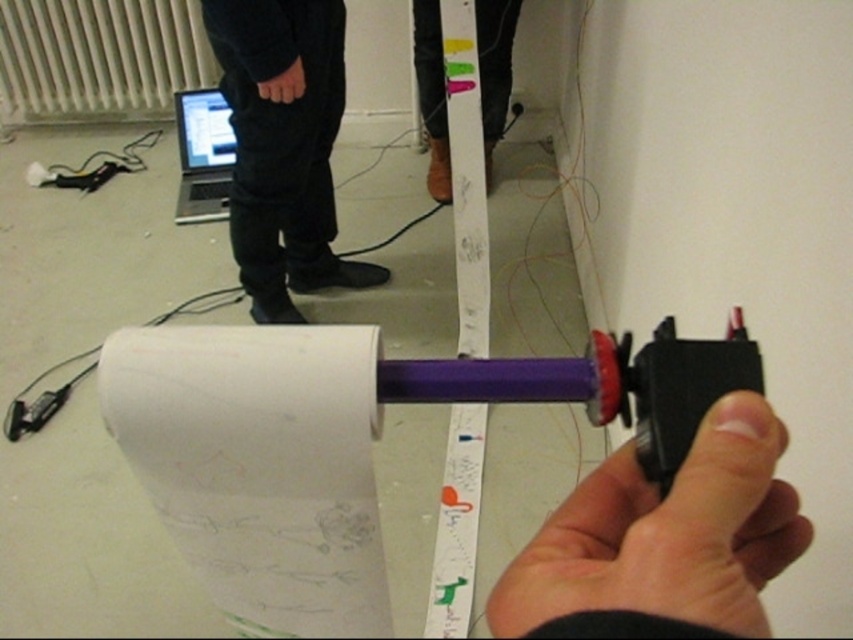
Question: Which point is farther from the camera taking this photo?

Choices:
 (A) (231, 154)
 (B) (743, 400)

Answer: (A)

Question: Does brown leather shoes at lower center have a larger size compared to silver metallic laptop at upper left?

Choices:
 (A) no
 (B) yes

Answer: (B)

Question: Is black matte hand at center above silver metallic laptop at upper left?

Choices:
 (A) no
 (B) yes

Answer: (A)

Question: Which point is farther to the camera?

Choices:
 (A) white textured radiator at upper left
 (B) brown leather shoes at lower center
 (C) silver metallic laptop at upper left
 (D) black matte hand at center

Answer: (A)

Question: Which point is farther from the camera taking this photo?

Choices:
 (A) (210, 147)
 (B) (438, 88)

Answer: (A)

Question: Is white paper at center to the left of white textured radiator at upper left from the viewer's perspective?

Choices:
 (A) yes
 (B) no

Answer: (B)